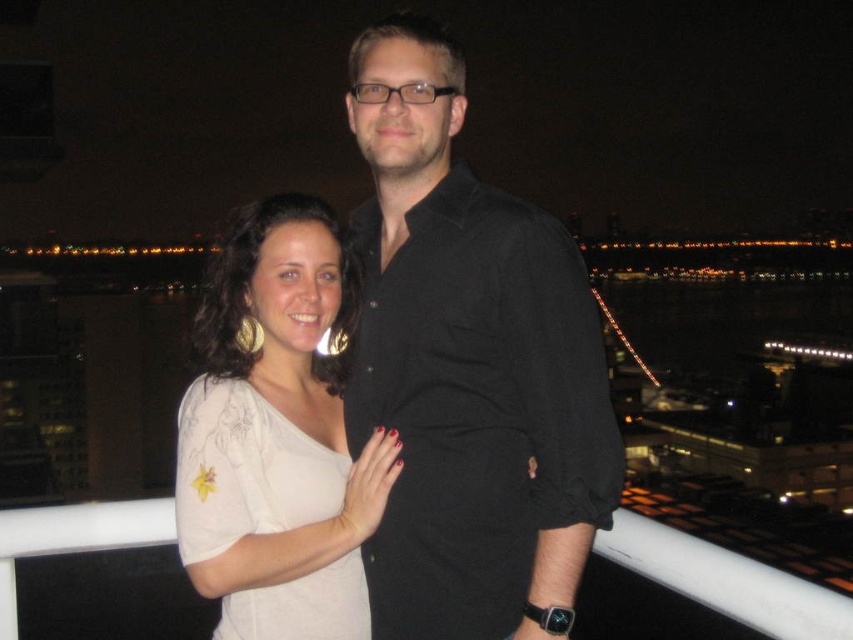
Question: Which of the following is the farthest from the observer?

Choices:
 (A) (534, 442)
 (B) (337, 452)

Answer: (B)

Question: Is black cotton shirt at center behind white matte blouse at center?

Choices:
 (A) no
 (B) yes

Answer: (B)

Question: Is the position of black cotton shirt at center more distant than that of white matte blouse at center?

Choices:
 (A) no
 (B) yes

Answer: (B)

Question: Can you confirm if black cotton shirt at center is positioned below white matte blouse at center?

Choices:
 (A) yes
 (B) no

Answer: (B)

Question: Among these points, which one is farthest from the camera?

Choices:
 (A) (347, 268)
 (B) (492, 224)

Answer: (A)

Question: Which point appears farthest from the camera in this image?

Choices:
 (A) (492, 481)
 (B) (260, 342)

Answer: (B)